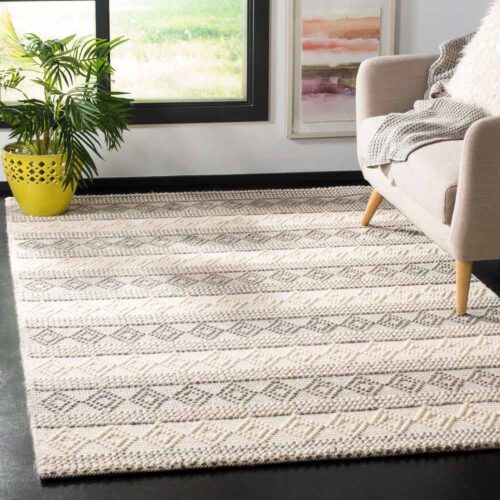
Locate an element on the screen. floor in front of rug is located at coordinates (383, 478).